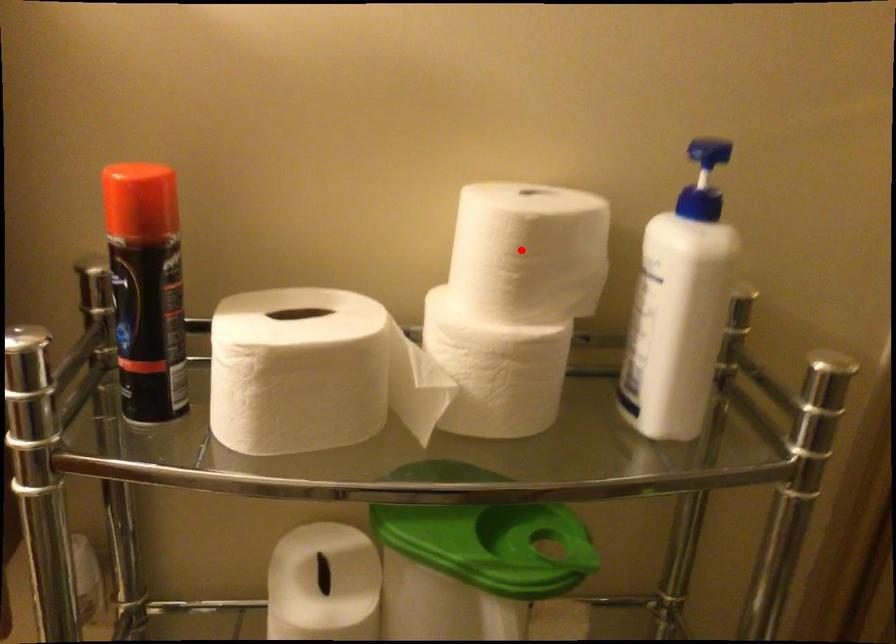
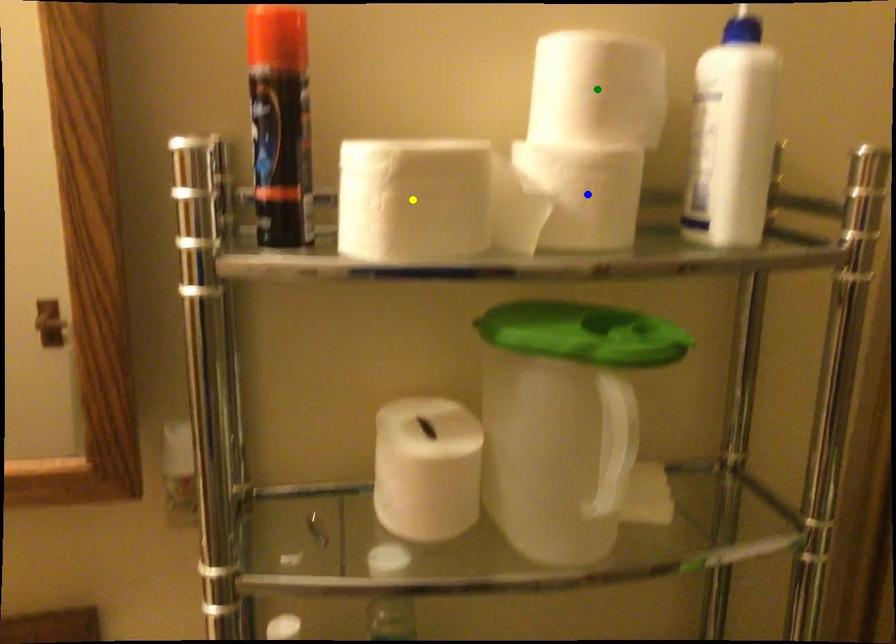
Question: I am providing you with two images of the same scene from different viewpoints. A red point is marked on the first image. You are given multiple points on the second image. Which point in image 2 represents the same 3d spot as the red point in image 1?

Choices:
 (A) yellow point
 (B) blue point
 (C) green point

Answer: (C)